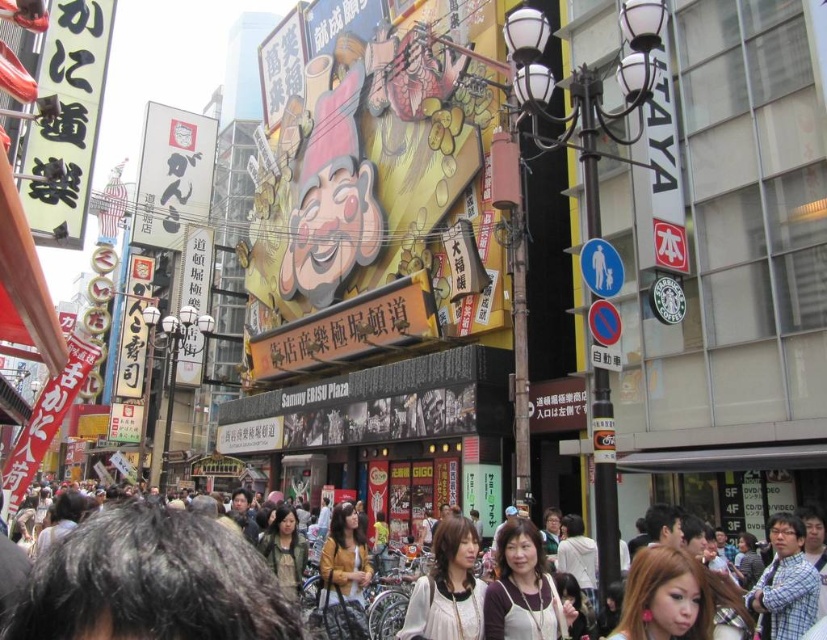
You are a photographer standing in the middle of the bustling urban street scene. You want to capture a photo of the multicolored clothing at center and the plaid shirt at lower right. Which object should you focus on first if you want to include both in your frame without moving the camera?

The multicolored clothing at center is above the plaid shirt at lower right, so you should focus on the multicolored clothing at center first to ensure both are in the frame without moving the camera.

You are a photographer trying to capture a candid shot of the multicolored clothing at center and the matte brown hair at center in the busy street scene. Which object should you focus on first to ensure it appears in the foreground of your photo?

The multicolored clothing at center is shorter than the matte brown hair at center, so to have it in the foreground, focus on the matte brown hair at center first since it is taller and would be closer to the camera.

You are a photographer trying to capture both the matte white blouse at center and the plaid shirt at lower right in a single shot. Given their sizes, which one might you need to position closer to the camera to ensure both appear similarly sized in the photo?

The matte white blouse at center is bigger than the plaid shirt at lower right. To make them appear similarly sized in the photo, you should position the plaid shirt at lower right closer to the camera since it is smaller in size.